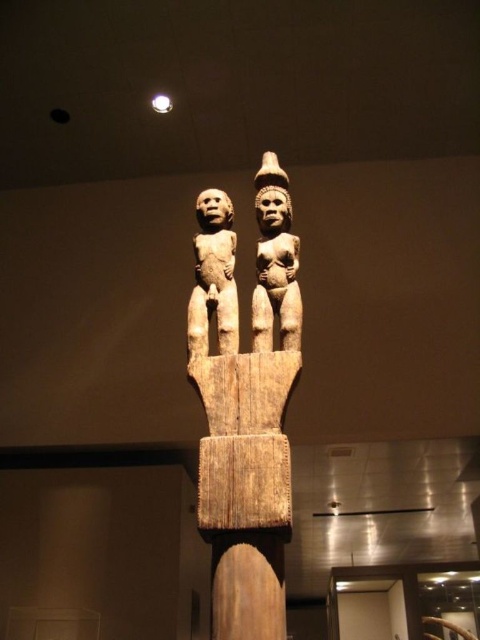
Is wooden statue at center above brown wooden statue at center?

No.

Who is positioned more to the left, wooden statue at center or brown wooden statue at center?

From the viewer's perspective, wooden statue at center appears more on the left side.

You are a GUI agent. You are given a task and a screenshot of the screen. Output one action in this format:
    pyautogui.click(x=<x>, y=<y>)
    Task: Click on the wooden statue at center
    
    Given the screenshot: What is the action you would take?
    pyautogui.click(x=252, y=435)

Identify the location of wooden statue at center. This screenshot has width=480, height=640. (252, 435).

Between wooden statue at center and light brown wood figure at center, which one appears on the left side from the viewer's perspective?

Positioned to the left is light brown wood figure at center.

Find the location of `wooden statue at center`. wooden statue at center is located at coordinates (252, 435).

Find the location of a particular element. This screenshot has height=640, width=480. wooden statue at center is located at coordinates (252, 435).

Which is more to the left, brown wooden statue at center or light brown wood figure at center?

Positioned to the left is light brown wood figure at center.

Locate an element on the screen. The height and width of the screenshot is (640, 480). brown wooden statue at center is located at coordinates (275, 260).

Locate an element on the screen. The image size is (480, 640). brown wooden statue at center is located at coordinates (275, 260).

You are a GUI agent. You are given a task and a screenshot of the screen. Output one action in this format:
    pyautogui.click(x=<x>, y=<y>)
    Task: Click on the brown wooden statue at center
    The width and height of the screenshot is (480, 640).
    Given the screenshot: What is the action you would take?
    pyautogui.click(x=275, y=260)